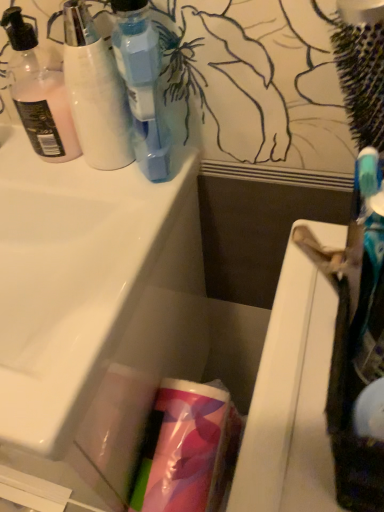
Question: In terms of size, does translucent plastic bottle at upper left, which is the second bottle from right to left, appear bigger or smaller than translucent pink lotion at left, which is the third bottle from right to left?

Choices:
 (A) big
 (B) small

Answer: (A)

Question: Is translucent plastic bottle at upper left, which is the second bottle from right to left, spatially inside translucent pink lotion at left, which is the first bottle in left-to-right order, or outside of it?

Choices:
 (A) inside
 (B) outside

Answer: (B)

Question: Which of these objects is positioned closest to the transparent plastic bottle at upper left, the 1th bottle from the right?

Choices:
 (A) translucent pink lotion at left, which is the third bottle from right to left
 (B) white glossy sink at center
 (C) translucent plastic bottle at upper left, the 2th bottle positioned from the left
 (D) translucent plastic roll at center

Answer: (C)

Question: Which object is positioned closest to the white glossy sink at center?

Choices:
 (A) translucent plastic roll at center
 (B) translucent plastic bottle at upper left, which is the second bottle from right to left
 (C) translucent pink lotion at left, which is the third bottle from right to left
 (D) transparent plastic bottle at upper left, which is the 3th bottle in left-to-right order

Answer: (B)